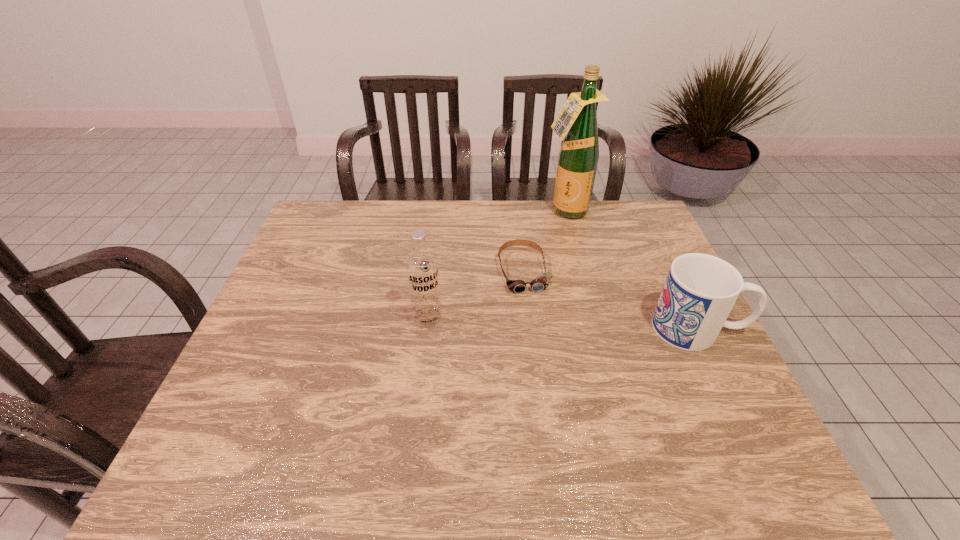
In order to click on the leftmost object in this screenshot , I will do `click(421, 265)`.

This screenshot has width=960, height=540. In order to click on vodka in this screenshot , I will do `click(421, 265)`.

Identify the location of the rightmost object. coord(700,291).

You are a GUI agent. You are given a task and a screenshot of the screen. Output one action in this format:
    pyautogui.click(x=<x>, y=<y>)
    Task: Click on the mug
    This screenshot has width=960, height=540.
    Given the screenshot: What is the action you would take?
    pyautogui.click(x=700, y=291)

This screenshot has width=960, height=540. Find the location of `goggles`. goggles is located at coordinates (541, 282).

Find the location of a particular element. the shortest object is located at coordinates (541, 282).

Locate an element on the screen. The height and width of the screenshot is (540, 960). the third object from left to right is located at coordinates (577, 121).

Where is `the tallest object`? This screenshot has height=540, width=960. the tallest object is located at coordinates (577, 121).

What are the coordinates of `free space located 0.140m on the front label of the third shortest object` in the screenshot? It's located at (420, 375).

Image resolution: width=960 pixels, height=540 pixels. Identify the location of free space located 0.060m on the left of the third tallest object. (630, 328).